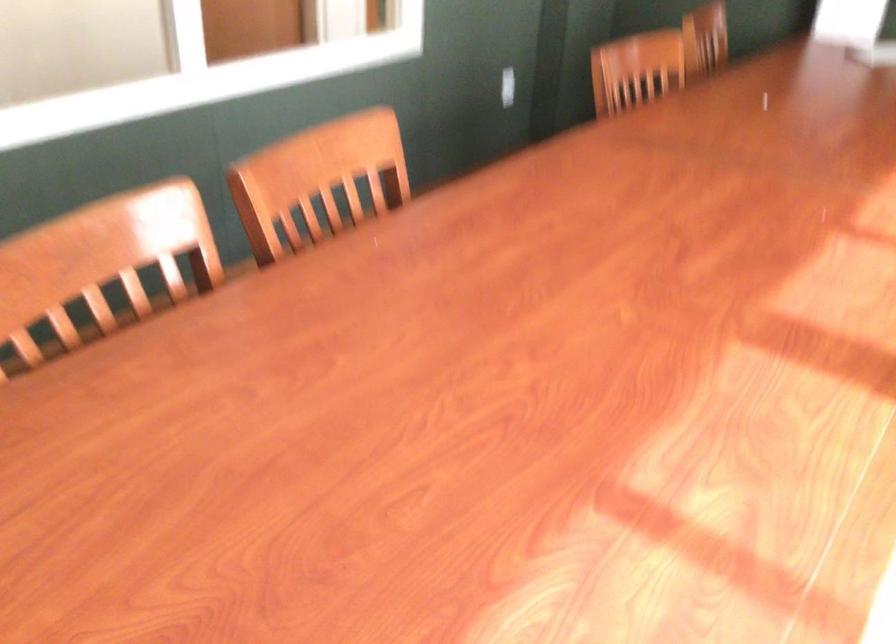
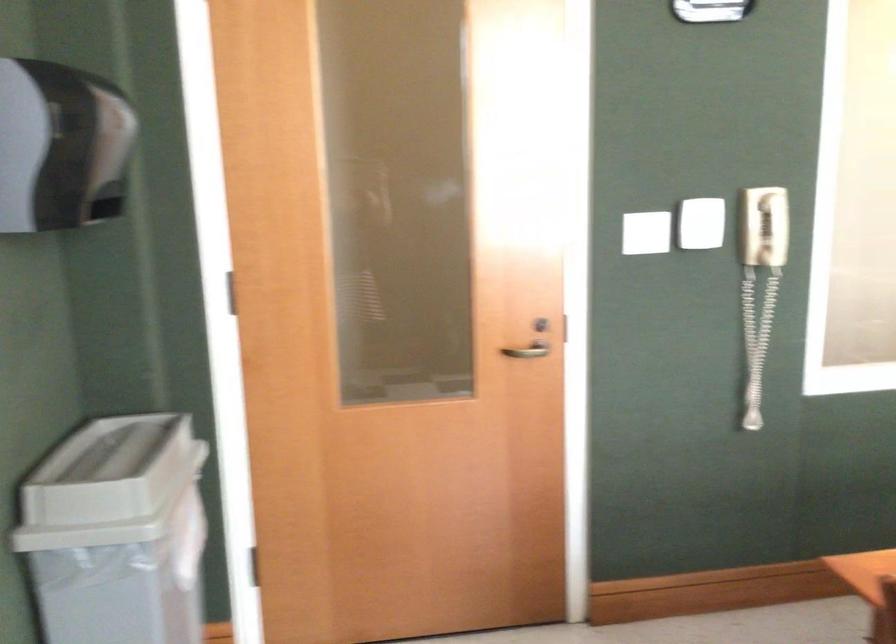
Question: How did the camera likely rotate?

Choices:
 (A) Left
 (B) Right
 (C) Up
 (D) Down

Answer: (A)